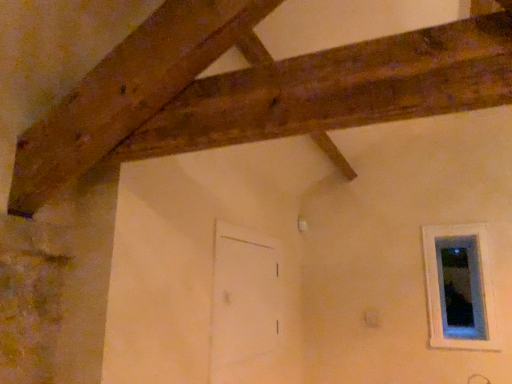
The image size is (512, 384). Identify the location of blue glass window at upper right. (460, 290).

The image size is (512, 384). What do you see at coordinates (460, 290) in the screenshot?
I see `blue glass window at upper right` at bounding box center [460, 290].

The height and width of the screenshot is (384, 512). In order to click on blue glass window at upper right in this screenshot , I will do `click(460, 290)`.